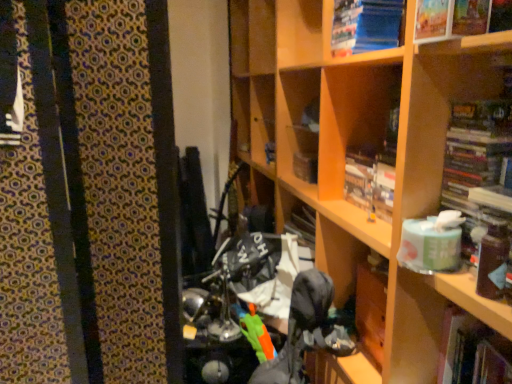
Question: Which is correct: blue paper at upper right, arranged as the 5th book when ordered from the bottom, is inside hardcover book at right, which appears as the second book when ordered from the bottom, or outside of it?

Choices:
 (A) outside
 (B) inside

Answer: (A)

Question: Considering the positions of point (346, 34) and point (483, 140), is point (346, 34) closer or farther from the camera than point (483, 140)?

Choices:
 (A) farther
 (B) closer

Answer: (A)

Question: Based on their relative distances, which object is farther from the matte paper book at upper right, which ranks as the 2th book in top-to-bottom order?

Choices:
 (A) wooden bookshelf at center
 (B) hardcover book at upper center, which appears as the third book when ordered from the bottom
 (C) hardcover book at right, which is counted as the fourth book, starting from the top
 (D) blue paper at upper right, which appears as the 1th book when viewed from the top
 (E) hardcover book at lower right, marked as the fifth book in a top-to-bottom arrangement

Answer: (E)

Question: Which is farther from the hardcover book at lower right, acting as the first book starting from the bottom?

Choices:
 (A) blue paper at upper right, arranged as the 5th book when ordered from the bottom
 (B) hardcover book at right, which appears as the second book when ordered from the bottom
 (C) wooden bookshelf at center
 (D) matte paper book at upper right, positioned as the 4th book in bottom-to-top order
 (E) hardcover book at upper center, the third book positioned from the top

Answer: (A)